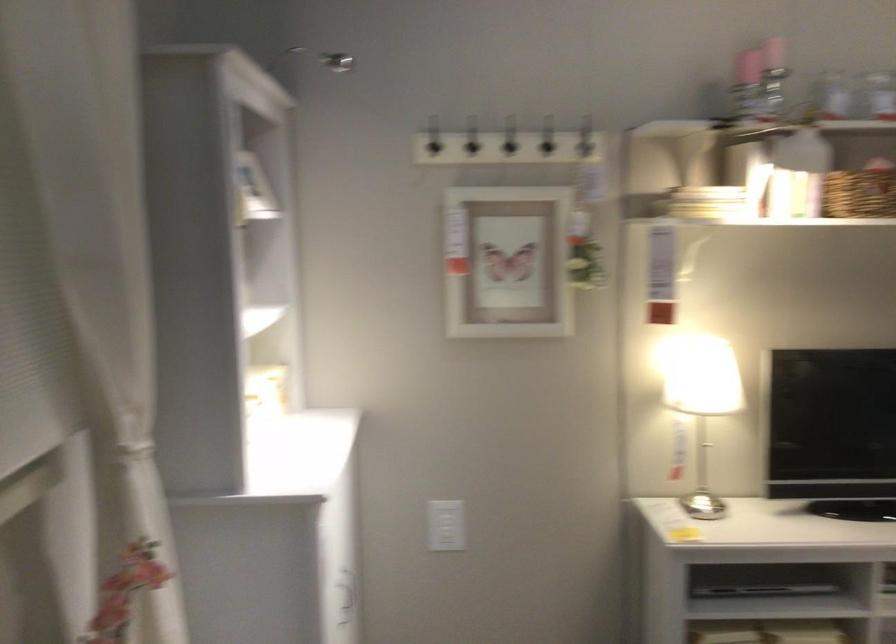
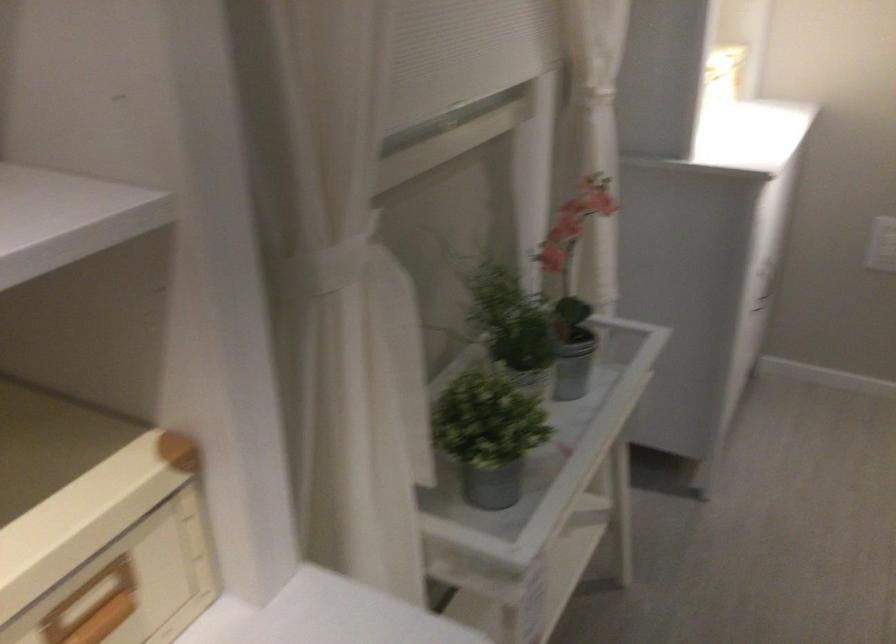
The images are taken continuously from a first-person perspective. In which direction is your viewpoint rotating?

The camera rotated toward left-down.